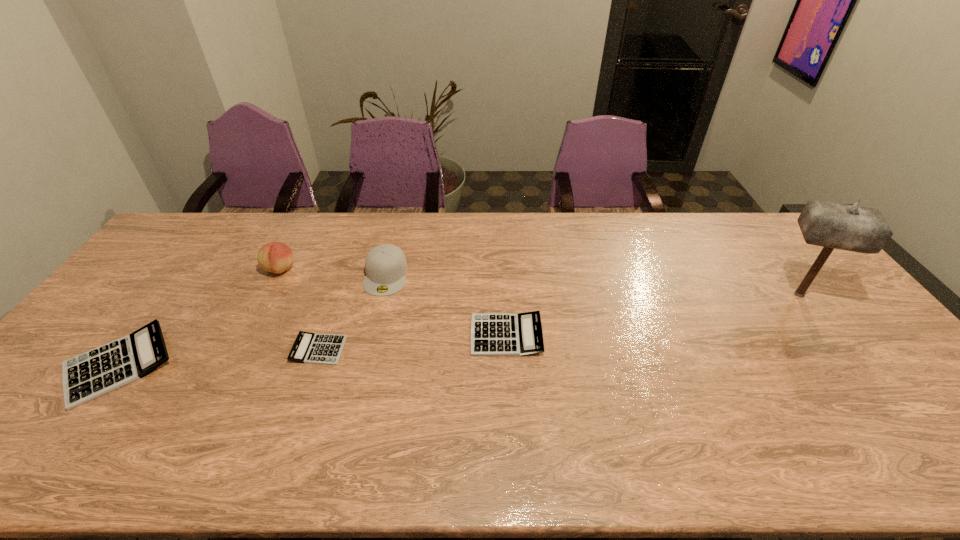
In order to click on vacant area situated on the back of the shortest object in this screenshot , I will do `click(329, 319)`.

Where is `vacant space located 0.380m on the left of the fifth tallest object`? vacant space located 0.380m on the left of the fifth tallest object is located at coordinates click(x=333, y=335).

At what (x,y) coordinates should I click in order to perform the action: click on free space located on the left of the fifth object from right to left. Please return your answer as a coordinate pair (x, y). Image resolution: width=960 pixels, height=540 pixels. Looking at the image, I should click on (173, 269).

What are the coordinates of `vacant space situated on the back of the tallest object` in the screenshot? It's located at (765, 249).

This screenshot has width=960, height=540. In order to click on vacant space located 0.250m on the front-facing side of the third object from right to left in this screenshot , I will do `click(365, 364)`.

Locate an element on the screen. The height and width of the screenshot is (540, 960). object present at the near edge is located at coordinates (87, 376).

Locate an element on the screen. Image resolution: width=960 pixels, height=540 pixels. object positioned at the left edge is located at coordinates (87, 376).

I want to click on object that is at the right edge, so click(831, 225).

Locate an element on the screen. The height and width of the screenshot is (540, 960). object situated at the near left corner is located at coordinates (87, 376).

In the image, there is a desktop. At what (x,y) coordinates should I click in order to perform the action: click on free space at the far edge. Please return your answer as a coordinate pair (x, y). The height and width of the screenshot is (540, 960). Looking at the image, I should click on coord(378,226).